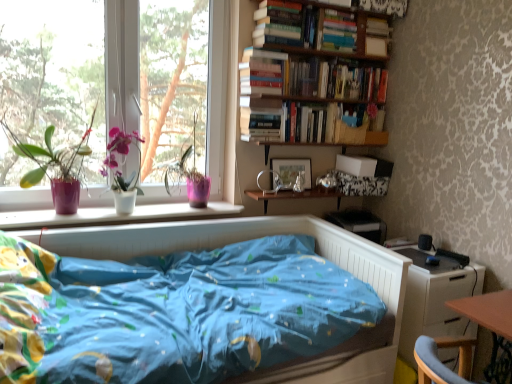
At what (x,y) coordinates should I click in order to perform the action: click on free region under pink plastic pot at window (from a real-world perspective). Please return your answer as a coordinate pair (x, y). Looking at the image, I should click on (181, 206).